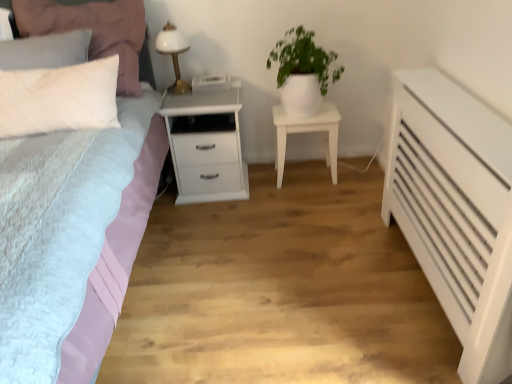
Question: Is white matte pot at upper center closer to camera compared to white matte nightstand at center, the 1th nightstand viewed from the right?

Choices:
 (A) no
 (B) yes

Answer: (B)

Question: From a real-world perspective, is white matte pot at upper center physically above white matte nightstand at center, the 1th nightstand viewed from the right?

Choices:
 (A) yes
 (B) no

Answer: (A)

Question: Are white matte pot at upper center and white matte nightstand at center, the 1th nightstand viewed from the right, beside each other?

Choices:
 (A) no
 (B) yes

Answer: (A)

Question: Can you confirm if white matte pot at upper center is thinner than white matte nightstand at center, the 1th nightstand viewed from the right?

Choices:
 (A) no
 (B) yes

Answer: (A)

Question: From a real-world perspective, does white matte pot at upper center sit lower than white matte nightstand at center, positioned as the 2th nightstand in left-to-right order?

Choices:
 (A) no
 (B) yes

Answer: (A)

Question: Which is correct: white matte nightstand at center, the 1th nightstand viewed from the right, is inside matte pink bed at left, or outside of it?

Choices:
 (A) inside
 (B) outside

Answer: (B)

Question: Looking at the image, does white matte nightstand at center, the 1th nightstand viewed from the right, seem bigger or smaller compared to matte pink bed at left?

Choices:
 (A) big
 (B) small

Answer: (B)

Question: In the image, is white matte nightstand at center, the 1th nightstand viewed from the right, positioned in front of or behind matte pink bed at left?

Choices:
 (A) behind
 (B) front

Answer: (A)

Question: Based on their positions, is white matte nightstand at center, positioned as the 2th nightstand in left-to-right order, located to the left or right of matte pink bed at left?

Choices:
 (A) right
 (B) left

Answer: (A)

Question: In the image, is white glossy bedside lamp at upper left on the left side or the right side of white matte nightstand at center, the 1th nightstand viewed from the right?

Choices:
 (A) right
 (B) left

Answer: (B)

Question: Considering the positions of white glossy bedside lamp at upper left and white matte nightstand at center, positioned as the 2th nightstand in left-to-right order, in the image, is white glossy bedside lamp at upper left taller or shorter than white matte nightstand at center, positioned as the 2th nightstand in left-to-right order,?

Choices:
 (A) tall
 (B) short

Answer: (B)

Question: Based on their sizes in the image, would you say white glossy bedside lamp at upper left is bigger or smaller than white matte nightstand at center, the 1th nightstand viewed from the right?

Choices:
 (A) small
 (B) big

Answer: (A)

Question: Considering the positions of point (174, 29) and point (337, 114), is point (174, 29) closer or farther from the camera than point (337, 114)?

Choices:
 (A) closer
 (B) farther

Answer: (A)

Question: From their relative heights in the image, would you say white matte pot at upper center is taller or shorter than white matte nightstand at center, positioned as the 2th nightstand in left-to-right order?

Choices:
 (A) short
 (B) tall

Answer: (B)

Question: From the image's perspective, relative to white matte nightstand at center, positioned as the 2th nightstand in left-to-right order, is white matte pot at upper center above or below?

Choices:
 (A) below
 (B) above

Answer: (B)